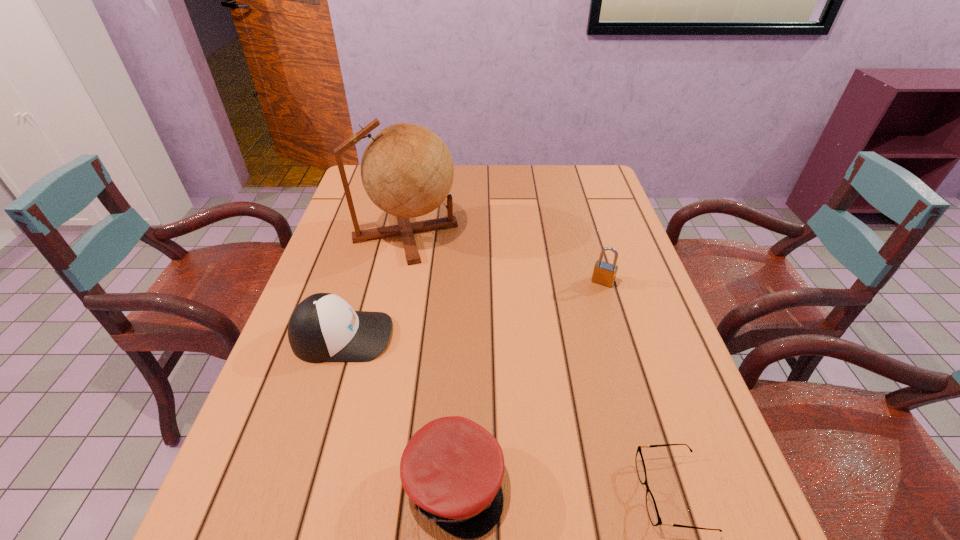
Where is `vacant space located on the front panel of the taller cap`? The height and width of the screenshot is (540, 960). vacant space located on the front panel of the taller cap is located at coordinates (436, 336).

Identify the location of free location located 0.230m on the front-facing side of the second shortest object. (636, 484).

This screenshot has height=540, width=960. I want to click on free space located 0.250m on the front-facing side of the spectacles, so click(x=496, y=493).

This screenshot has height=540, width=960. Find the location of `free spot located 0.300m on the front-facing side of the spectacles`. free spot located 0.300m on the front-facing side of the spectacles is located at coordinates (467, 493).

You are a GUI agent. You are given a task and a screenshot of the screen. Output one action in this format:
    pyautogui.click(x=<x>, y=<y>)
    Task: Click on the free space located 0.330m on the front-facing side of the spectacles
    
    Given the screenshot: What is the action you would take?
    pyautogui.click(x=449, y=493)

You are a GUI agent. You are given a task and a screenshot of the screen. Output one action in this format:
    pyautogui.click(x=<x>, y=<y>)
    Task: Click on the cap positioned at the near edge
    Image resolution: width=960 pixels, height=540 pixels.
    Given the screenshot: What is the action you would take?
    pyautogui.click(x=452, y=468)

Where is `spectacles at the near edge`? The image size is (960, 540). spectacles at the near edge is located at coordinates (652, 509).

The width and height of the screenshot is (960, 540). Find the location of `globe present at the left edge`. globe present at the left edge is located at coordinates (407, 170).

At what (x,y) coordinates should I click in order to perform the action: click on cap positioned at the left edge. Please return your answer as a coordinate pair (x, y). This screenshot has width=960, height=540. Looking at the image, I should click on (323, 328).

Where is `padlock that is at the right edge`? The image size is (960, 540). padlock that is at the right edge is located at coordinates (604, 273).